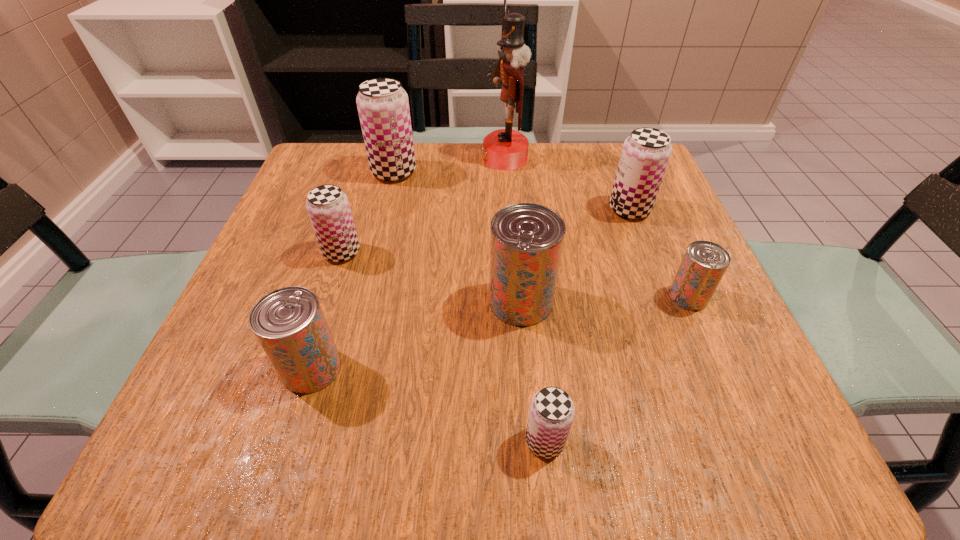
This screenshot has height=540, width=960. I want to click on free space at the left edge, so click(x=303, y=217).

Locate an element on the screen. This screenshot has width=960, height=540. free region at the right edge of the desktop is located at coordinates (654, 278).

The height and width of the screenshot is (540, 960). In order to click on vacant space at the far right corner of the desktop in this screenshot , I will do `click(594, 198)`.

Image resolution: width=960 pixels, height=540 pixels. I want to click on free space between the second purple beer can from right to left and the second red beer can from right to left, so click(x=533, y=371).

Locate an element on the screen. The width and height of the screenshot is (960, 540). free area in between the second purple beer can from right to left and the third farthest purple beer can is located at coordinates (444, 346).

The width and height of the screenshot is (960, 540). I want to click on free space between the red nutcracker and the second biggest purple beer can, so click(x=567, y=184).

Where is `empty location between the nutcracker and the farthest purple beer can`? empty location between the nutcracker and the farthest purple beer can is located at coordinates (449, 165).

At what (x,y) coordinates should I click in order to perform the action: click on empty location between the seventh farthest object and the second red beer can from left to right. Please return your answer as a coordinate pair (x, y). The image size is (960, 540). Looking at the image, I should click on (417, 335).

I want to click on unoccupied area between the fourth farthest object and the leftmost red beer can, so [x=326, y=310].

This screenshot has width=960, height=540. In order to click on empty location between the third biggest purple beer can and the smallest purple beer can in this screenshot , I will do `click(444, 346)`.